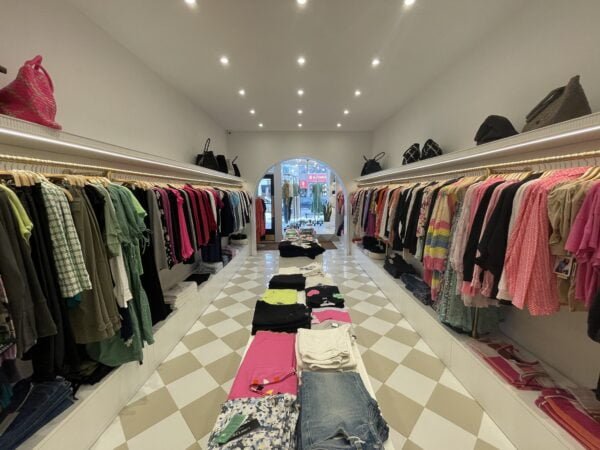
The height and width of the screenshot is (450, 600). Find the location of `ceiling`. ceiling is located at coordinates (265, 50).